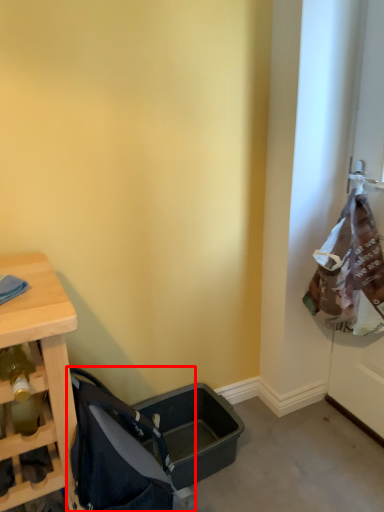
Question: From the image's perspective, considering the relative positions of baby carriage (annotated by the red box) and screen door in the image provided, where is baby carriage (annotated by the red box) located with respect to the staircase?

Choices:
 (A) above
 (B) below

Answer: (B)